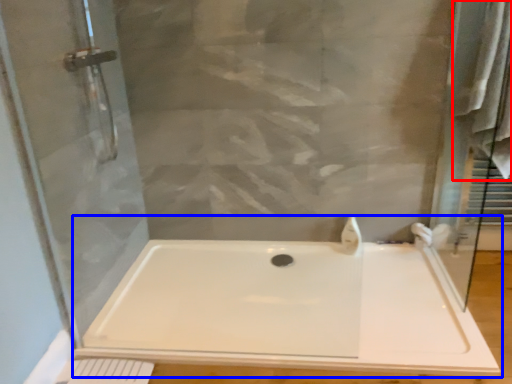
Question: Which of the following is the farthest to the observer, bath towel (highlighted by a red box) or bathtub (highlighted by a blue box)?

Choices:
 (A) bath towel
 (B) bathtub

Answer: (A)